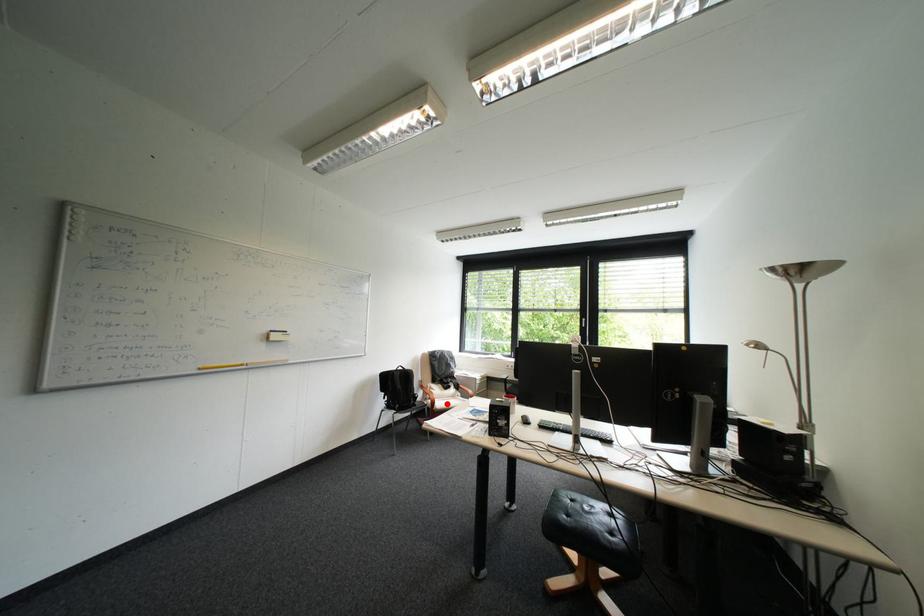
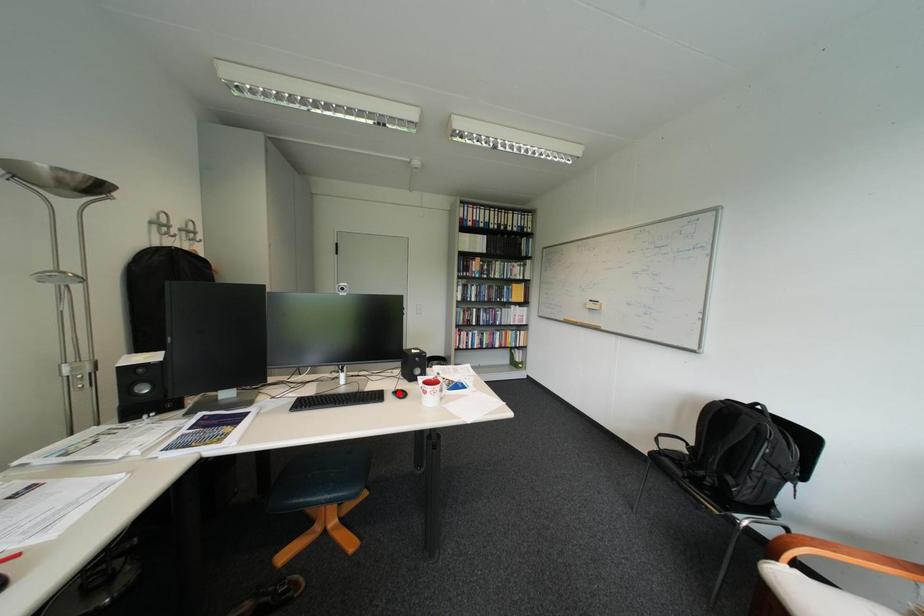
I am providing you with two images of the same scene from different viewpoints. A red point is marked on the first image and another point is marked on the second image. Are the points marked in image1 and image2 representing the same 3D position?

No